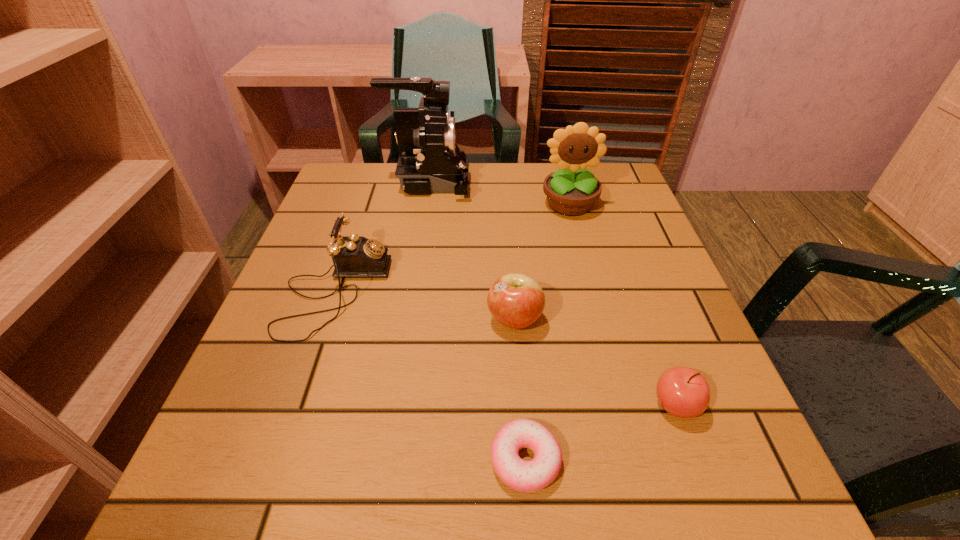
You are a GUI agent. You are given a task and a screenshot of the screen. Output one action in this format:
    pyautogui.click(x=<x>, y=<y>)
    Task: Click on the free space located on the dial of the telephone
    Image resolution: width=960 pixels, height=540 pixels.
    Given the screenshot: What is the action you would take?
    pyautogui.click(x=452, y=292)

I want to click on free region located on the front of the left apple, so click(x=517, y=363).

Where is `free space located 0.280m on the back of the fifth farthest object`? free space located 0.280m on the back of the fifth farthest object is located at coordinates pos(626,267).

What are the coordinates of `free space located on the left of the shortest object` in the screenshot? It's located at (230, 460).

Where is `camcorder located at the far edge`? The image size is (960, 540). camcorder located at the far edge is located at coordinates (430, 161).

What are the coordinates of `sunflower that is at the far edge` in the screenshot? It's located at (572, 190).

You are a GUI agent. You are given a task and a screenshot of the screen. Output one action in this format:
    pyautogui.click(x=<x>, y=<y>)
    Task: Click on the object that is at the near edge
    
    Given the screenshot: What is the action you would take?
    pyautogui.click(x=524, y=476)

You are a GUI agent. You are given a task and a screenshot of the screen. Output one action in this format:
    pyautogui.click(x=<x>, y=<y>)
    Task: Click on the camcorder at the left edge
    
    Given the screenshot: What is the action you would take?
    pyautogui.click(x=430, y=161)

Identify the location of telephone that is at the left edge. The width and height of the screenshot is (960, 540). (353, 256).

Identify the location of sunflower positioned at the right edge. (572, 190).